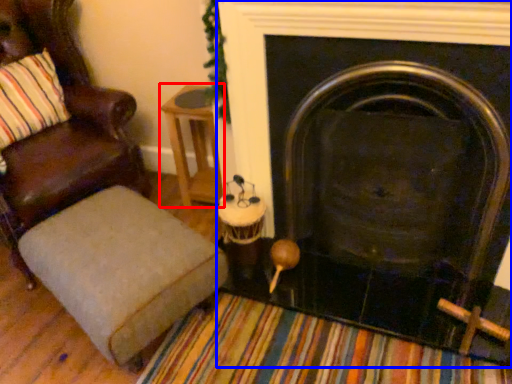
Question: Among these objects, which one is nearest to the camera, side table (highlighted by a red box) or fireplace (highlighted by a blue box)?

Choices:
 (A) side table
 (B) fireplace

Answer: (B)